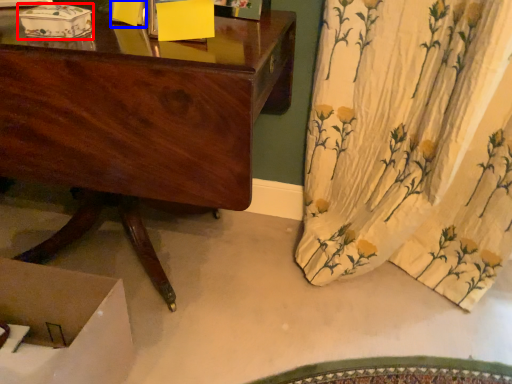
Question: Which object appears closest to the camera in this image, box (highlighted by a red box) or box (highlighted by a blue box)?

Choices:
 (A) box
 (B) box

Answer: (A)